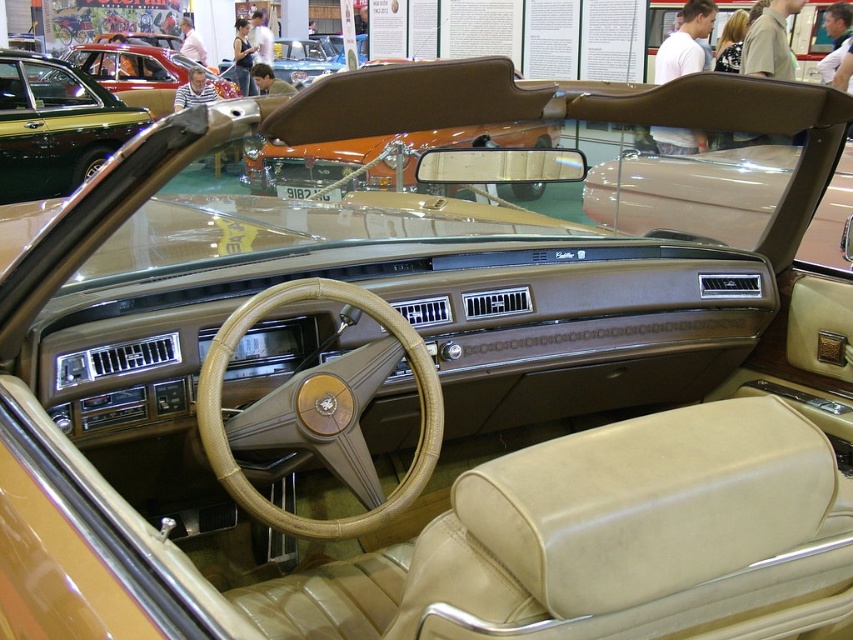
Does point (248, 486) come farther from viewer compared to point (306, 152)?

No, it is in front of (306, 152).

Does point (358, 529) come closer to viewer compared to point (376, 177)?

Yes, it is.

Is point (332, 531) behind point (350, 145)?

No, (332, 531) is closer to viewer.

I want to click on leather textured steering wheel at center, so click(x=225, y=433).

Does leather textured steering wheel at center have a greater width compared to matte gold steering wheel at center?

No.

Is leather textured steering wheel at center to the right of matte gold steering wheel at center from the viewer's perspective?

Indeed, leather textured steering wheel at center is positioned on the right side of matte gold steering wheel at center.

Measure the distance between point (405, 340) and camera.

1.90 meters

The width and height of the screenshot is (853, 640). Find the location of `leather textured steering wheel at center`. leather textured steering wheel at center is located at coordinates (225, 433).

Can you confirm if matte gold steering wheel at center is positioned to the right of matte brown convertible top at center?

In fact, matte gold steering wheel at center is to the left of matte brown convertible top at center.

Which of these two, matte gold steering wheel at center or matte brown convertible top at center, stands taller?

matte gold steering wheel at center is taller.

Identify the location of matte gold steering wheel at center. (55, 125).